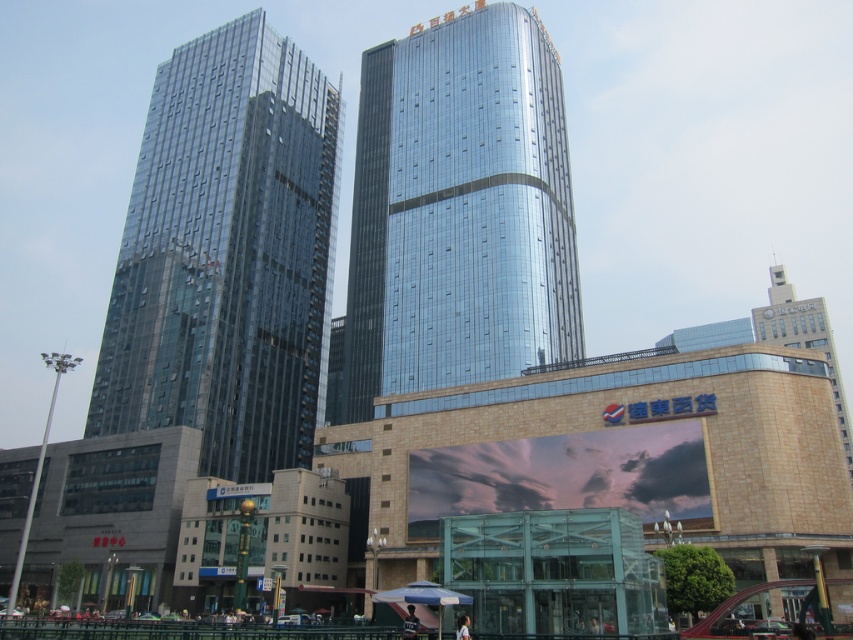
Does transparent glass skyscraper at center have a lesser height compared to glossy glass building at center?

No, transparent glass skyscraper at center is not shorter than glossy glass building at center.

The height and width of the screenshot is (640, 853). Identify the location of transparent glass skyscraper at center. (227, 256).

Can you confirm if glossy glass building at center is taller than beige stone tower at right?

Yes.

Between point (387, 90) and point (792, 291), which one is positioned in front?

Point (387, 90) is in front.

Identify the location of glossy glass building at center. The width and height of the screenshot is (853, 640). (459, 209).

Which is more to the right, beige stone tower at right or white striped fabric umbrella at lower center?

From the viewer's perspective, beige stone tower at right appears more on the right side.

Does beige stone tower at right lie behind white striped fabric umbrella at lower center?

Yes, it is behind white striped fabric umbrella at lower center.

I want to click on beige stone tower at right, so click(x=802, y=339).